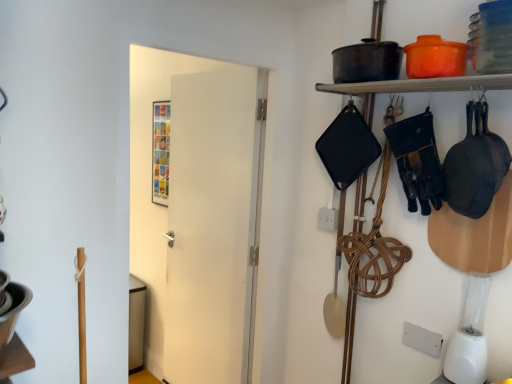
What do you see at coordinates (469, 336) in the screenshot? The height and width of the screenshot is (384, 512). I see `white plastic blender at lower right` at bounding box center [469, 336].

Image resolution: width=512 pixels, height=384 pixels. Find the location of `matte black pot at upper right`. matte black pot at upper right is located at coordinates (421, 85).

From the image's perspective, is white matte door at center positioned above or below matte black pot at upper right?

Clearly, from the image's perspective, white matte door at center is below matte black pot at upper right.

Is white matte door at center not within matte black pot at upper right?

white matte door at center is positioned outside matte black pot at upper right.

Locate an element on the screen. The width and height of the screenshot is (512, 384). door on the left of the matte black pot at upper right is located at coordinates (196, 212).

Is white matte door at center directly adjacent to matte black pot at upper right?

No, white matte door at center is not touching matte black pot at upper right.

Between white plastic blender at lower right and matte black pot at upper right, which one appears on the right side from the viewer's perspective?

white plastic blender at lower right.

Considering their positions, is white plastic blender at lower right located in front of or behind matte black pot at upper right?

white plastic blender at lower right is behind matte black pot at upper right.

Based on the photo, from a real-world perspective, is white plastic blender at lower right below matte black pot at upper right?

Yes, from a real-world perspective, white plastic blender at lower right is under matte black pot at upper right.

Between matte black pot at upper right and white matte door at center, which one has smaller size?

With smaller size is matte black pot at upper right.

Can you confirm if matte black pot at upper right is positioned to the right of white matte door at center?

Correct, you'll find matte black pot at upper right to the right of white matte door at center.

Considering the points (386, 88) and (139, 155), which point is in front, point (386, 88) or point (139, 155)?

Point (386, 88)

Looking at this image, from a real-world perspective, relative to white matte door at center, is matte black pot at upper right vertically above or below?

Clearly, from a real-world perspective, matte black pot at upper right is above white matte door at center.

Is white matte door at center oriented towards white plastic blender at lower right?

Yes, white matte door at center is turned towards white plastic blender at lower right.

Considering the sizes of objects white matte door at center and white plastic blender at lower right in the image provided, who is wider, white matte door at center or white plastic blender at lower right?

white plastic blender at lower right is wider.

You are a GUI agent. You are given a task and a screenshot of the screen. Output one action in this format:
    pyautogui.click(x=<x>, y=<y>)
    Task: Click on the door on the left side of white plastic blender at lower right
    
    Given the screenshot: What is the action you would take?
    pyautogui.click(x=196, y=212)

Who is shorter, white matte door at center or white plastic blender at lower right?

white plastic blender at lower right is shorter.

Is white plastic blender at lower right outside of white matte door at center?

Yes, white plastic blender at lower right is outside of white matte door at center.

From the image's perspective, who appears lower, white plastic blender at lower right or white matte door at center?

white plastic blender at lower right appears lower in the image.

Where is `door that is on the left side of white plastic blender at lower right`? door that is on the left side of white plastic blender at lower right is located at coordinates (196, 212).

Is white plastic blender at lower right facing away from white matte door at center?

No.

Which is more to the right, matte black pot at upper right or white plastic blender at lower right?

Positioned to the right is white plastic blender at lower right.

Locate an element on the screen. The height and width of the screenshot is (384, 512). appliance below the matte black pot at upper right (from a real-world perspective) is located at coordinates (469, 336).

From the image's perspective, which one is positioned higher, matte black pot at upper right or white plastic blender at lower right?

matte black pot at upper right appears higher in the image.

Could you tell me if matte black pot at upper right is facing white plastic blender at lower right?

No.

This screenshot has height=384, width=512. In order to click on shelf located on the right of white matte door at center in this screenshot , I will do `click(421, 85)`.

Where is `shelf in front of the white plastic blender at lower right`? This screenshot has height=384, width=512. shelf in front of the white plastic blender at lower right is located at coordinates (421, 85).

When comparing their distances from white matte door at center, does matte black pot at upper right or white plastic blender at lower right seem further?

white plastic blender at lower right lies further to white matte door at center than the other object.

From the image, which object appears to be nearer to white matte door at center, white plastic blender at lower right or matte black pot at upper right?

Among the two, matte black pot at upper right is located nearer to white matte door at center.

From the image, which object appears to be farther from white plastic blender at lower right, matte black pot at upper right or white matte door at center?

white matte door at center.

From the image, which object appears to be nearer to white plastic blender at lower right, white matte door at center or matte black pot at upper right?

Among the two, matte black pot at upper right is located nearer to white plastic blender at lower right.

Based on the photo, which object lies further to the anchor point matte black pot at upper right, white plastic blender at lower right or white matte door at center?

white matte door at center.

Considering their positions, is white matte door at center positioned further to matte black pot at upper right than white plastic blender at lower right?

white matte door at center is positioned further to the anchor matte black pot at upper right.

The image size is (512, 384). Find the location of `shelf between white matte door at center and white plastic blender at lower right`. shelf between white matte door at center and white plastic blender at lower right is located at coordinates (421, 85).